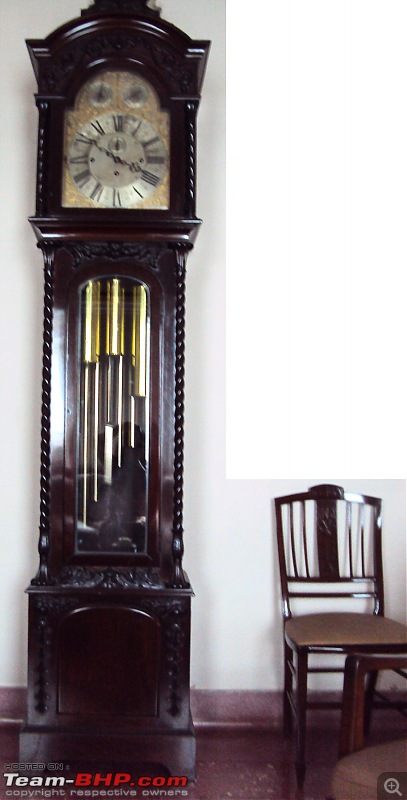
Find the location of a particular element. The width and height of the screenshot is (407, 800). grandfather clock is located at coordinates (111, 232).